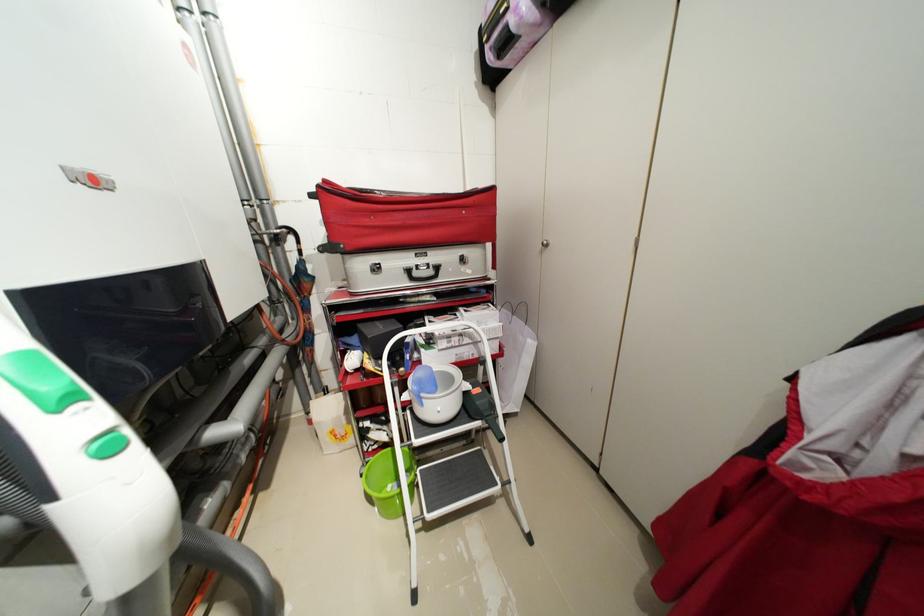
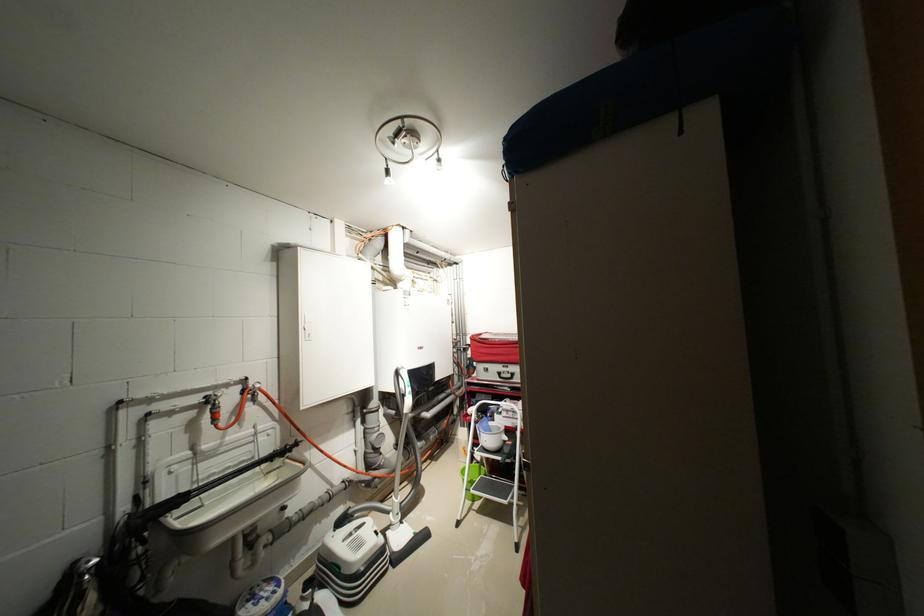
In the second image, find the point that corresponds to (257,216) in the first image.

(466, 341)